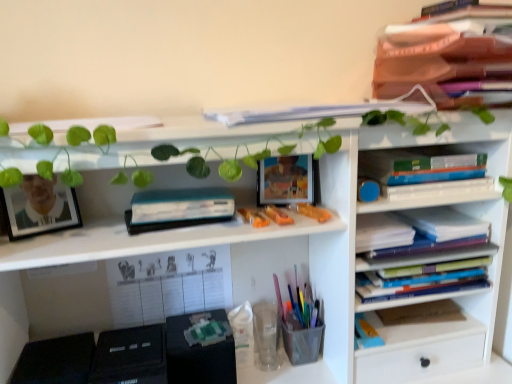
Where is `empty space that is ontop of blue hardcover book at center right, the 4th book when ordered from top to bottom`? empty space that is ontop of blue hardcover book at center right, the 4th book when ordered from top to bottom is located at coordinates (443, 211).